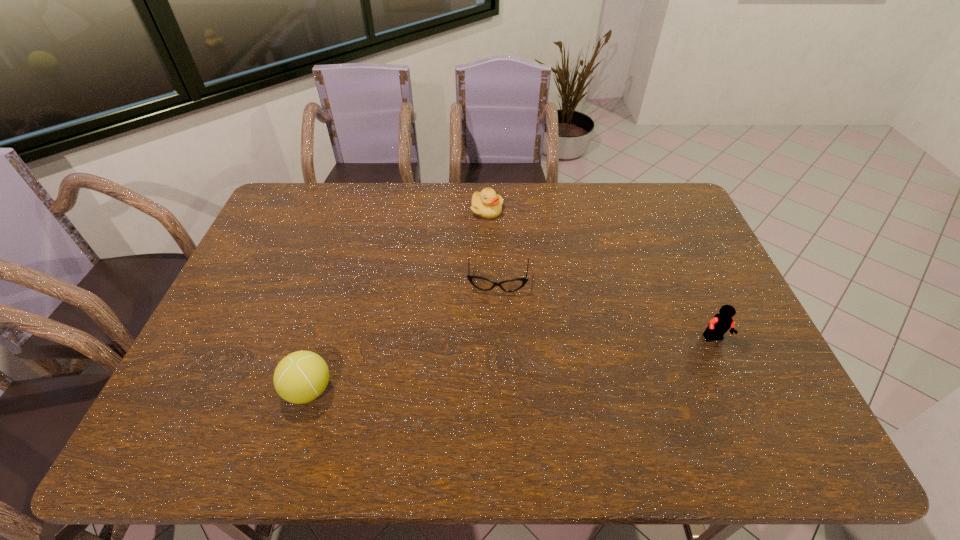
This screenshot has width=960, height=540. I want to click on free space located 0.120m on the front-facing side of the third nearest object, so click(x=494, y=327).

Locate an element on the screen. This screenshot has width=960, height=540. free space located on the front-facing side of the third nearest object is located at coordinates click(495, 315).

Image resolution: width=960 pixels, height=540 pixels. What are the coordinates of `vacant space located on the front-facing side of the third nearest object` in the screenshot? It's located at (494, 327).

The height and width of the screenshot is (540, 960). In order to click on free location located 0.340m on the beak of the duckling in this screenshot , I will do `click(506, 293)`.

At what (x,y) coordinates should I click in order to perform the action: click on vacant space located 0.310m on the beak of the duckling. Please return your answer as a coordinate pair (x, y). This screenshot has width=960, height=540. Looking at the image, I should click on (504, 285).

In order to click on vacant region located on the beak of the duckling in this screenshot , I will do pyautogui.click(x=502, y=275).

Where is `object at the far edge`? object at the far edge is located at coordinates coord(487,204).

Where is `object positioned at the near edge`? object positioned at the near edge is located at coordinates (302, 376).

The width and height of the screenshot is (960, 540). In order to click on object that is at the right edge in this screenshot , I will do `click(720, 323)`.

The height and width of the screenshot is (540, 960). I want to click on vacant space at the far edge of the desktop, so click(402, 218).